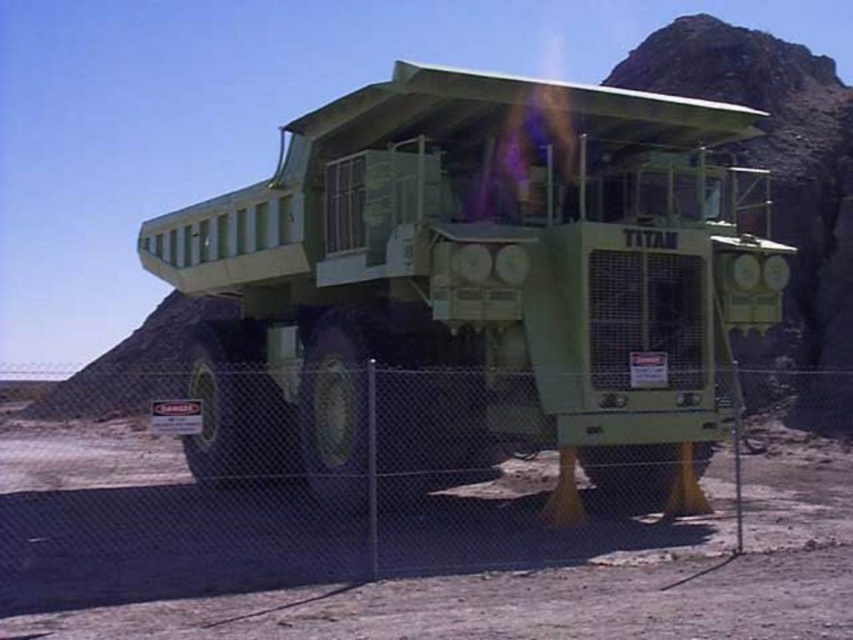
You are standing at the point marked by the coordinates point (x=473, y=285) in the image. What object is directly in front of you?

The point (x=473, y=285) indicates the green matte titan truck at center, so the object directly in front of you is the green matte titan truck at center.